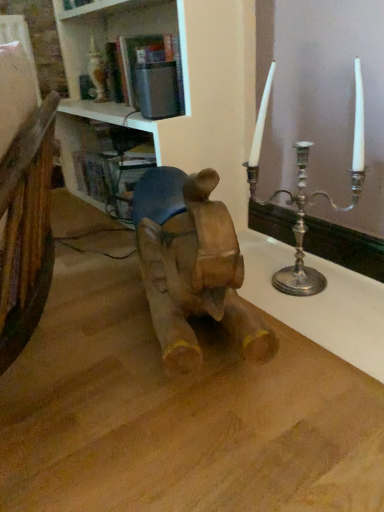
Identify the location of vacant space to the left of wooden horse at center. (84, 332).